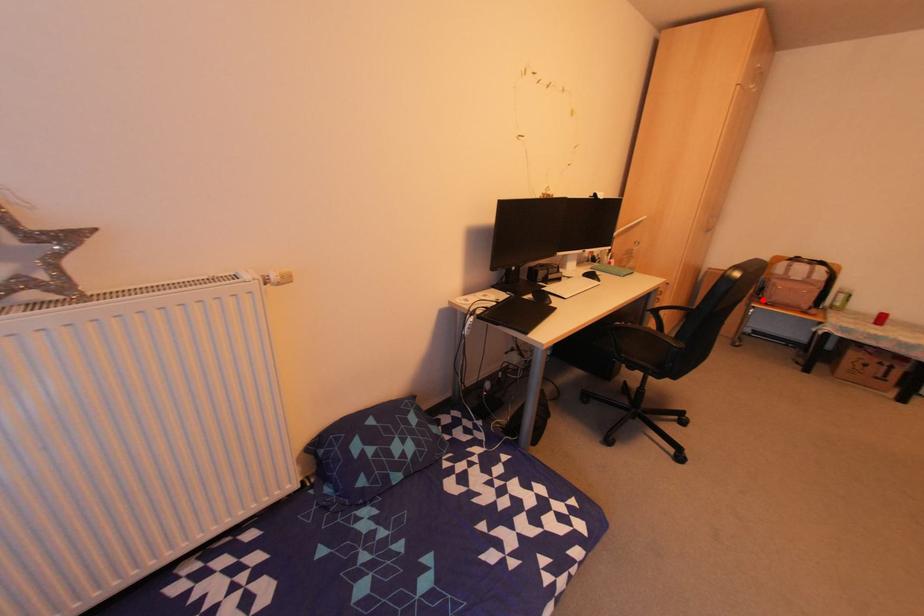
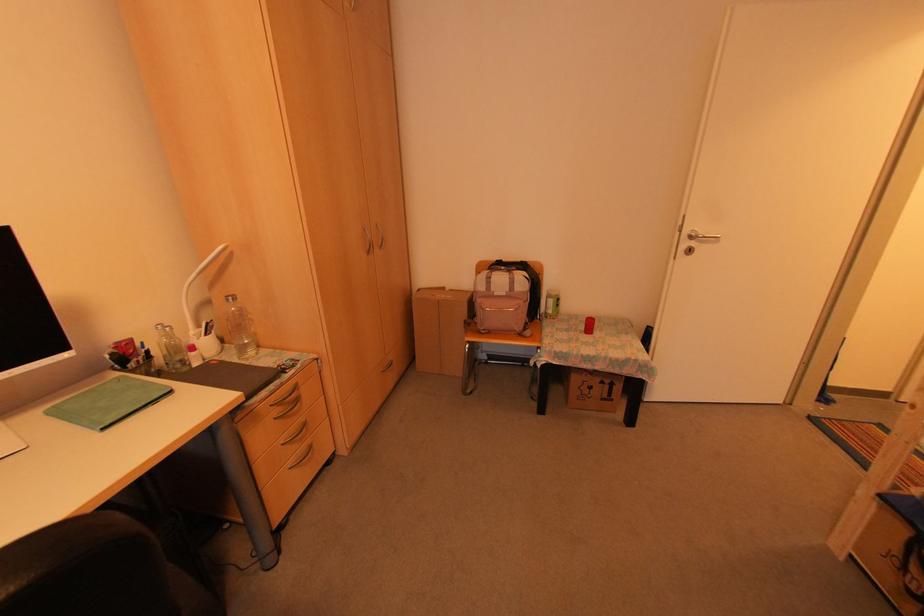
Where in the second image is the point corresponding to the highlighted location from the first image?

(477, 326)